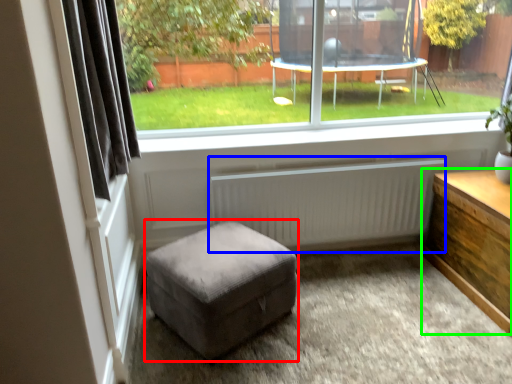
Question: Considering the real-world distances, which object is farthest from stool (highlighted by a red box)? radiator (highlighted by a blue box) or table (highlighted by a green box)?

Choices:
 (A) radiator
 (B) table

Answer: (B)